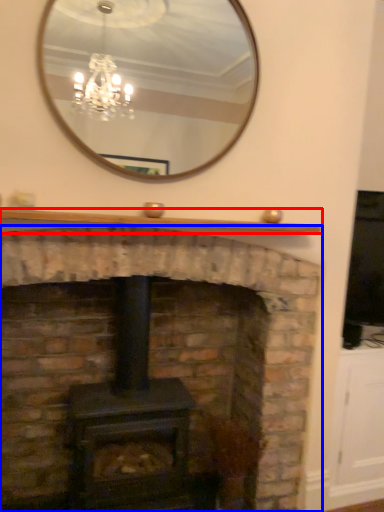
Question: Which object appears closest to the camera in this image, mantle (highlighted by a red box) or fireplace (highlighted by a blue box)?

Choices:
 (A) mantle
 (B) fireplace

Answer: (B)